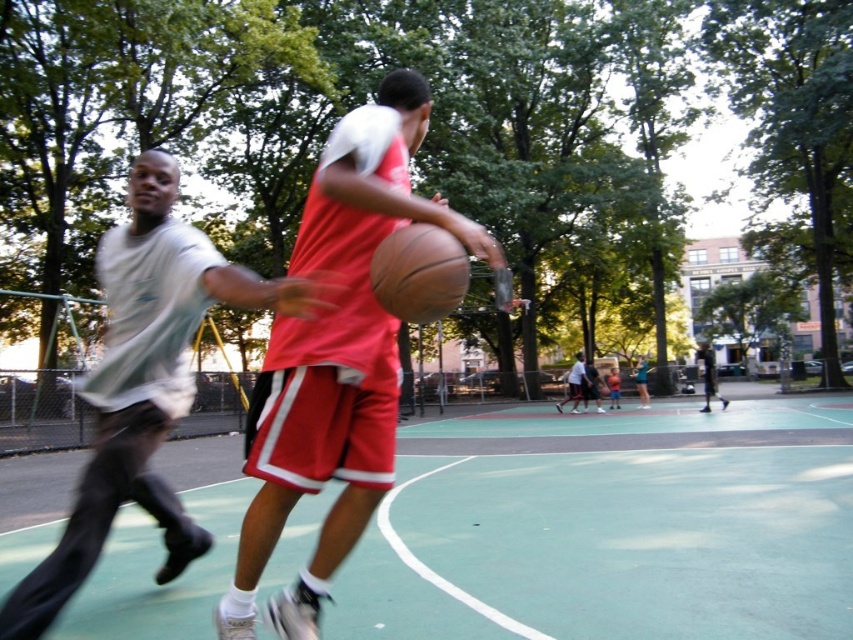
You are a photographer trying to capture a closeup of the basketball game. You notice two points marked in the scene, point 1 at coordinates point (171, 621) and point 2 at coordinates point (706, 401). Which point should you focus on to get a clearer image since it is closer to you?

Point (171, 621) is closer to the viewer than point (706, 401), so you should focus on point (171, 621) to get a clearer image.

You are a basketball coach analyzing the court layout. You notice the green rubber basketball court at center and the matte black basketball at center. Which object is taller?

The matte black basketball at center is taller than the green rubber basketball court at center.